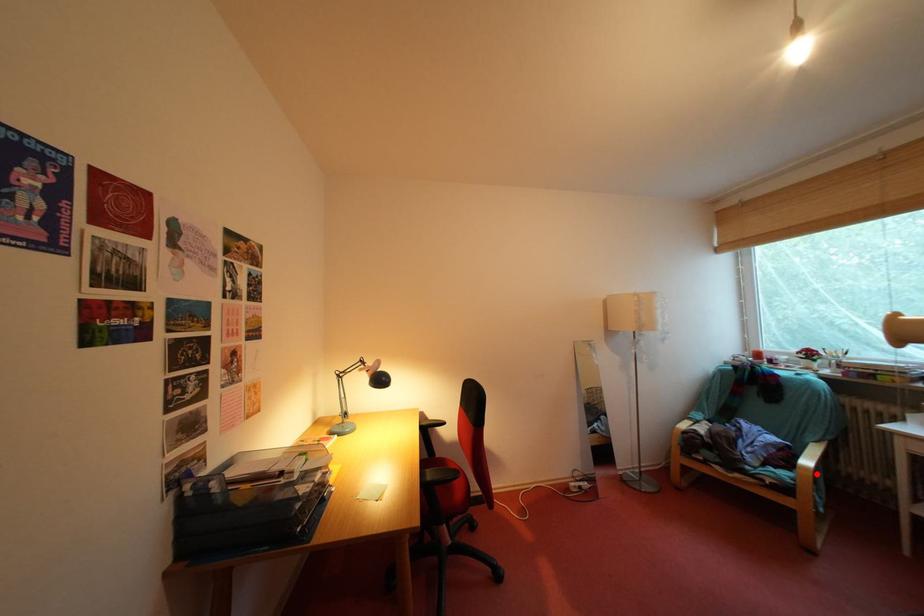
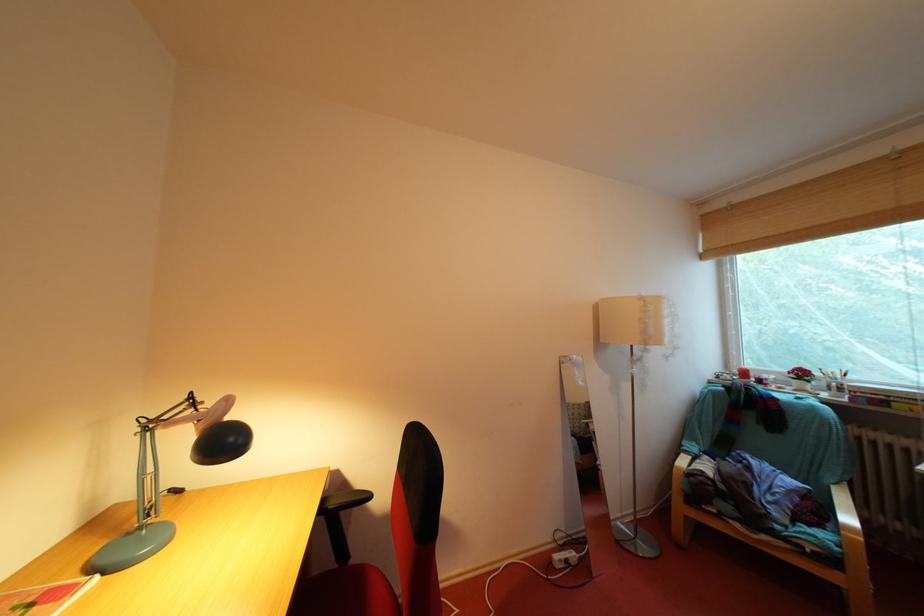
Where in the second image is the point corresponding to the highlighted location from the first image?

(861, 535)